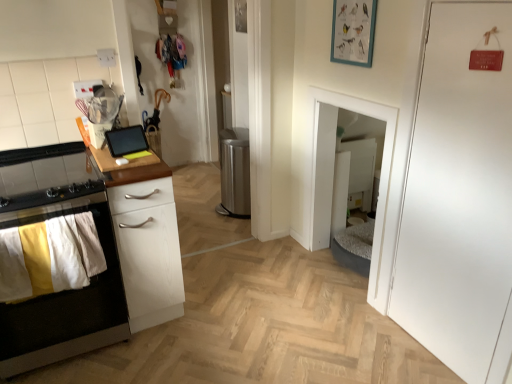
Where is `free space to the right of white wood chest of drawers at left`? The height and width of the screenshot is (384, 512). free space to the right of white wood chest of drawers at left is located at coordinates 221,299.